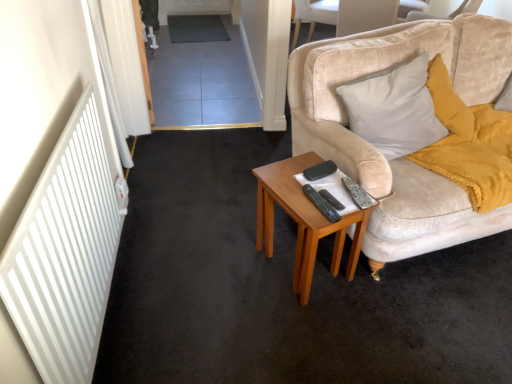
Image resolution: width=512 pixels, height=384 pixels. In order to click on blank space situated above woodenobject at center (from a real-world perspective) in this screenshot , I will do `click(322, 188)`.